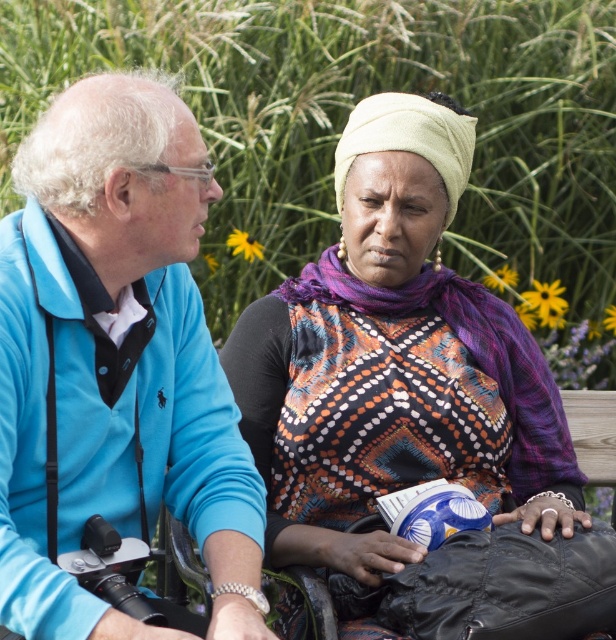
Can you confirm if blue velvety cardigan at left is thinner than patterned fabric scarf at center?

Yes, blue velvety cardigan at left is thinner than patterned fabric scarf at center.

Between blue velvety cardigan at left and patterned fabric scarf at center, which one is positioned higher?

Positioned higher is blue velvety cardigan at left.

At what (x,y) coordinates should I click in order to perform the action: click on blue velvety cardigan at left. Please return your answer as a coordinate pair (x, y). The height and width of the screenshot is (640, 616). Looking at the image, I should click on (118, 362).